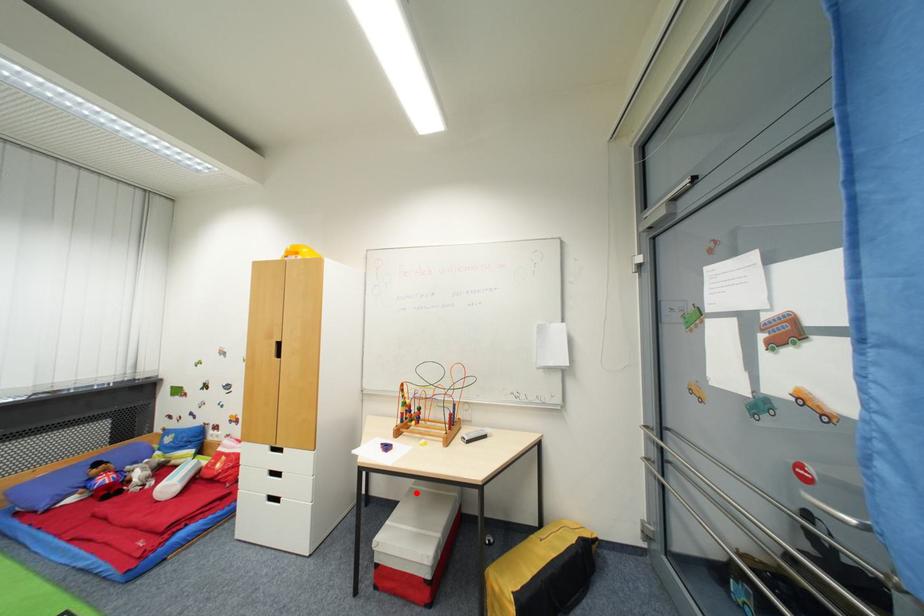
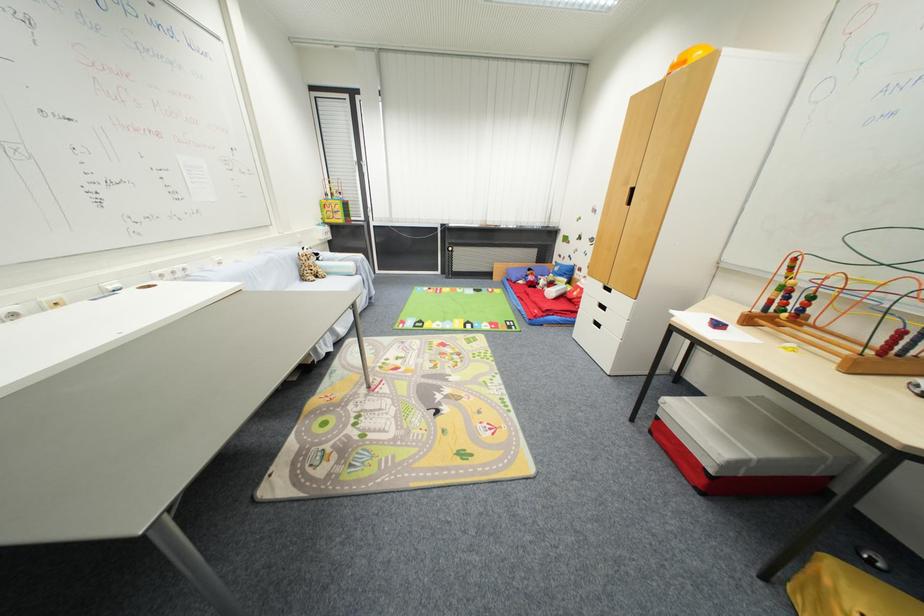
The point at the highlighted location is marked in the first image. Where is the corresponding point in the second image?

(745, 402)